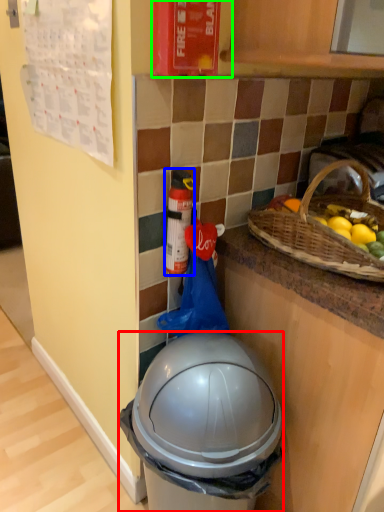
Question: Considering the real-world distances, which object is farthest from trash bin/can (highlighted by a red box)? bottle (highlighted by a blue box) or fire extinguisher (highlighted by a green box)?

Choices:
 (A) bottle
 (B) fire extinguisher

Answer: (B)